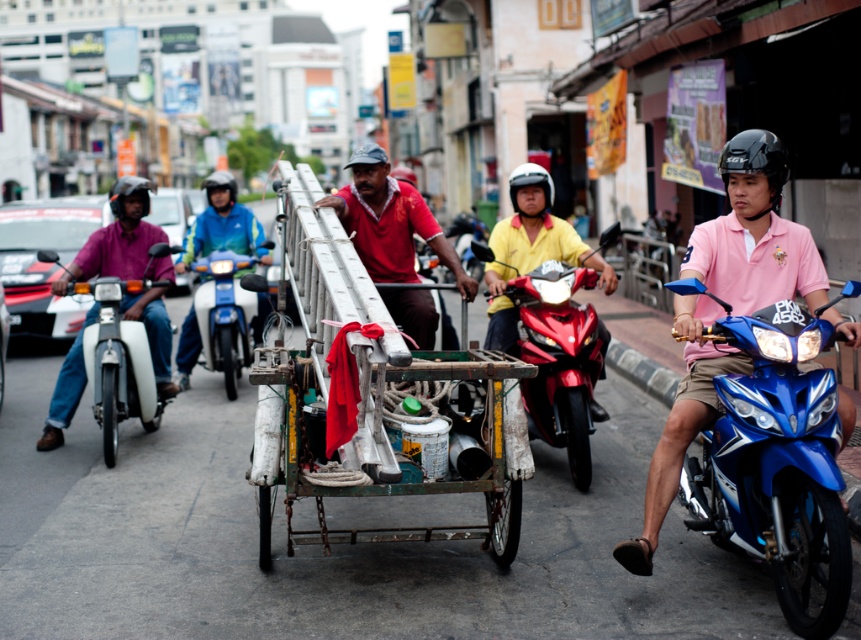
You are a delivery person who needs to choose a motorcycle to deliver packages in a narrow alley. The alley is only 1.5 meters wide. Given the shiny red motorcycle at center and the blue metallic motorcycle at center, which motorcycle would you choose and why?

The blue metallic motorcycle at center has a smaller width compared to the shiny red motorcycle at center. Since the alley is 1.5 meters wide, the blue metallic motorcycle at center would be more suitable as it is narrower and can maneuver through the narrow space more easily.

You are a pedestrian standing at the edge of the street. You see the rusty metal cart at center and the blue metallic motorcycle at right. Which object is closer to your left side?

The rusty metal cart at center is to the left of the blue metallic motorcycle at right, so the rusty metal cart at center is closer to your left side.